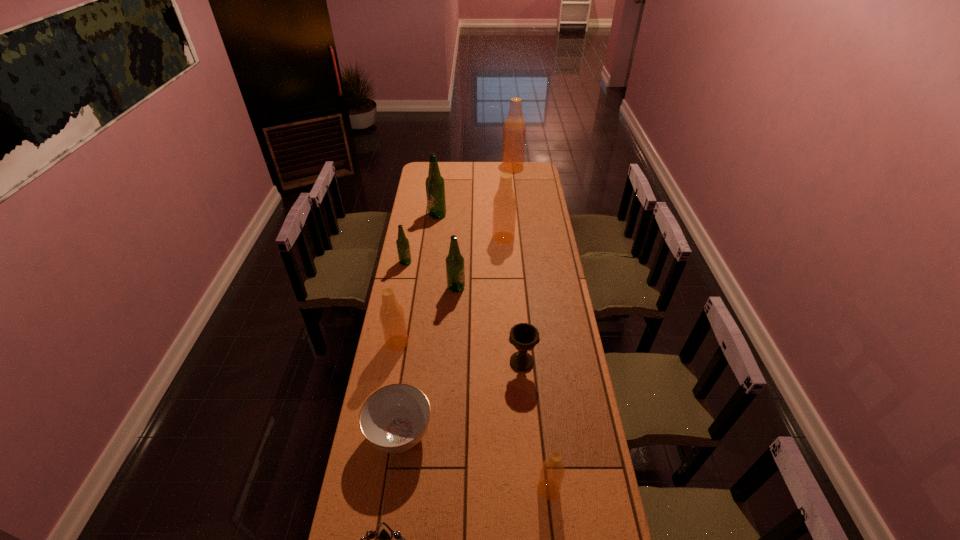
At what (x,y) coordinates should I click in order to perform the action: click on the tallest object. Please return your answer as a coordinate pair (x, y). Looking at the image, I should click on (514, 130).

You are a GUI agent. You are given a task and a screenshot of the screen. Output one action in this format:
    pyautogui.click(x=<x>, y=<y>)
    Task: Click on the farthest tan beer bottle
    The height and width of the screenshot is (540, 960).
    Given the screenshot: What is the action you would take?
    pyautogui.click(x=514, y=130)

Where is `the sixth nearest beer bottle`? the sixth nearest beer bottle is located at coordinates (435, 186).

Find the location of `the biggest green beer bottle`. the biggest green beer bottle is located at coordinates (435, 186).

Identify the location of the second biggest tan beer bottle. This screenshot has width=960, height=540. (504, 204).

The height and width of the screenshot is (540, 960). I want to click on the third nearest tan beer bottle, so click(504, 204).

Identify the location of the nearest green beer bottle. pyautogui.click(x=455, y=271).

This screenshot has height=540, width=960. What are the coordinates of `the fourth beer bottle from right to left` in the screenshot? It's located at (455, 271).

Identify the location of the leftmost tan beer bottle. This screenshot has height=540, width=960. (391, 313).

Where is `the second nearest tan beer bottle`? the second nearest tan beer bottle is located at coordinates (391, 313).